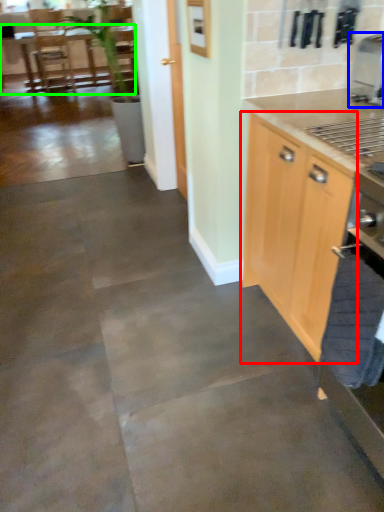
Question: Based on their relative distances, which object is nearer to cabinetry (highlighted by a red box)? Choose from coffee machine (highlighted by a blue box) and table (highlighted by a green box).

Choices:
 (A) coffee machine
 (B) table

Answer: (A)